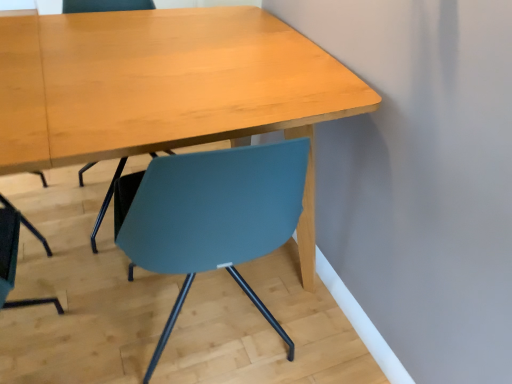
In order to click on matte wood table at center in this screenshot , I will do `click(165, 89)`.

Describe the element at coordinates (165, 89) in the screenshot. I see `matte wood table at center` at that location.

This screenshot has height=384, width=512. What are the coordinates of `matte wood table at center` in the screenshot? It's located at (165, 89).